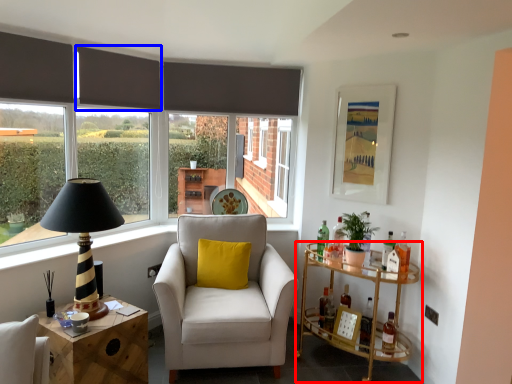
Question: Which of the following is the farthest to the observer, table (highlighted by a red box) or curtain (highlighted by a blue box)?

Choices:
 (A) table
 (B) curtain

Answer: (B)